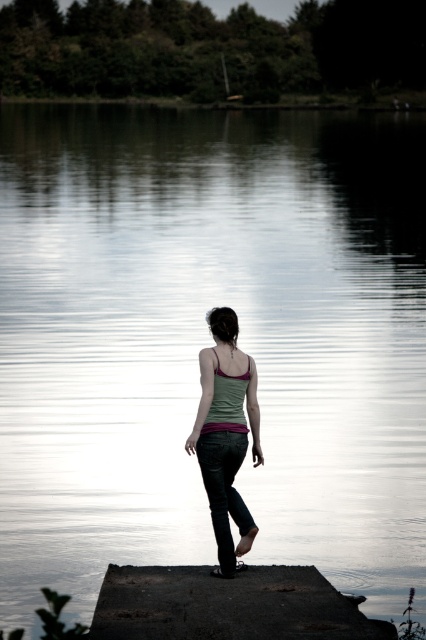
Who is taller, dark concrete dock at center or matte green tank top at center?

With more height is matte green tank top at center.

Is point (201, 605) less distant than point (218, 524)?

That is True.

Is point (336, 609) farther from camera compared to point (187, 451)?

No, (336, 609) is closer to viewer.

The height and width of the screenshot is (640, 426). I want to click on dark concrete dock at center, so click(227, 605).